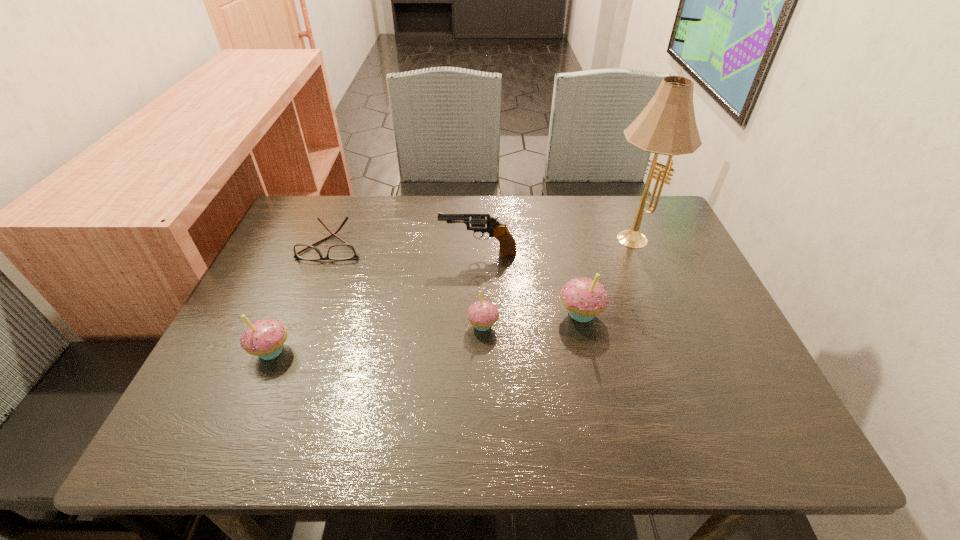
This screenshot has width=960, height=540. I want to click on the second tallest cupcake, so click(x=264, y=338).

You are a GUI agent. You are given a task and a screenshot of the screen. Output one action in this format:
    pyautogui.click(x=<x>, y=<y>)
    Task: Click on the shortest cupcake
    
    Given the screenshot: What is the action you would take?
    (x=482, y=314)

Locate an element on the screen. the second shortest object is located at coordinates (482, 314).

Locate an element on the screen. the rightmost cupcake is located at coordinates (584, 298).

The image size is (960, 540). What are the coordinates of `the tallest cupcake` in the screenshot? It's located at (584, 298).

You are a GUI agent. You are given a task and a screenshot of the screen. Output one action in this format:
    pyautogui.click(x=<x>, y=<y>)
    Task: Click on the tallest object
    The width and height of the screenshot is (960, 540).
    Given the screenshot: What is the action you would take?
    pyautogui.click(x=667, y=125)

The width and height of the screenshot is (960, 540). Find the location of `lampshade`. lampshade is located at coordinates (667, 125).

You are a GUI agent. You are given a task and a screenshot of the screen. Output one action in this format:
    pyautogui.click(x=<x>, y=<y>)
    Task: Click on the gun
    
    Given the screenshot: What is the action you would take?
    pyautogui.click(x=480, y=222)

Where is `the shortest object`? The width and height of the screenshot is (960, 540). the shortest object is located at coordinates (344, 251).

Where is `vacant area located on the right of the leftmost cupcake`? vacant area located on the right of the leftmost cupcake is located at coordinates (329, 350).